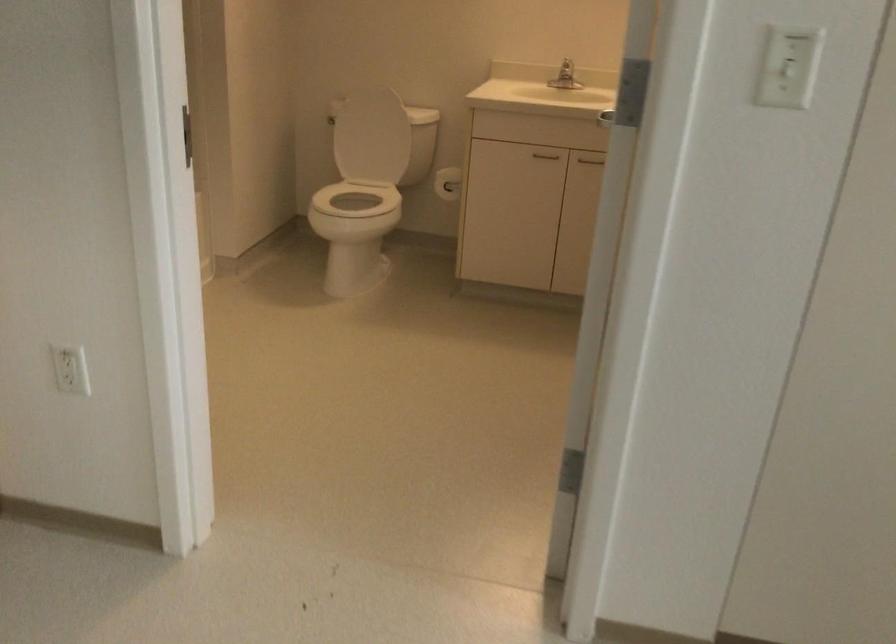
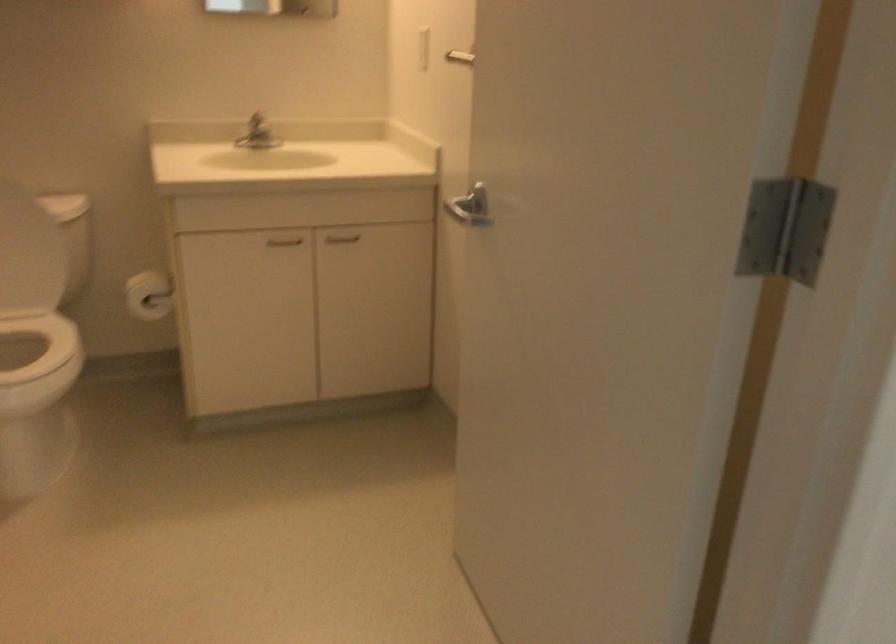
The point at (x=385, y=113) is marked in the first image. Where is the corresponding point in the second image?

(12, 210)